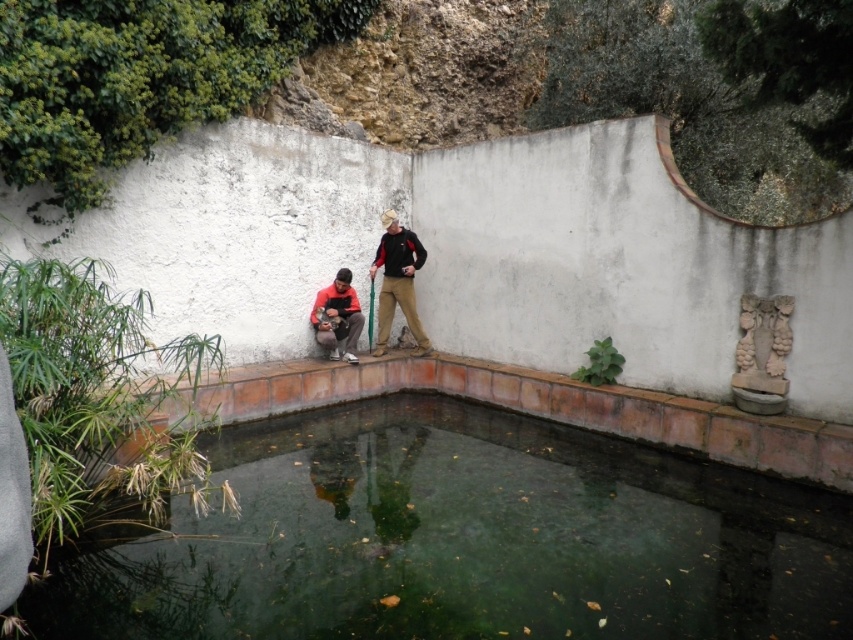
You are standing at the edge of the pool and want to throw a small stone into the green smooth water at center without getting your matte black jacket at center wet. The jacket is 0.5 meters long. Can you safely throw the stone from where you are standing?

The distance between the green smooth water at center and the matte black jacket at center is 3.59 meters. Since the jacket is only 0.5 meters long, you can safely throw the stone into the water without getting the jacket wet as the distance is sufficient.